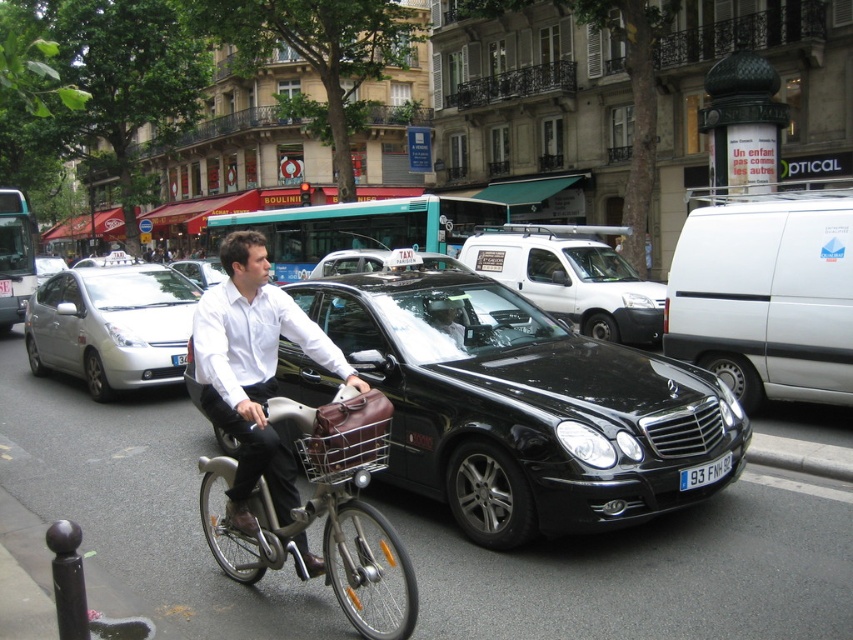
You are a delivery person who needs to park your 1.8 meters tall delivery box between the black glossy sedan at center and the silver metallic sedan at center. Can you fit it there?

The black glossy sedan at center is much taller than the silver metallic sedan at center. However, the height difference between them isn not specified, so it is uncertain if the 1.8 meters tall delivery box can fit between them.

You are a pedestrian standing on the sidewalk and see both the black glossy sedan at center and the silver metallic sedan at center. Which one is closer to the road?

The black glossy sedan at center is to the right of the silver metallic sedan at center, so it is closer to the road.

Based on the photo, you are standing on the sidewalk and want to cross the street to reach the black glossy sedan at center. The crosswalk is 5 meters away from your current position. Can you safely reach the sedan before the crosswalk ends?

The black glossy sedan at center is 4.43 meters from viewer, which is less than the 5 meters distance to the crosswalk. Therefore, you can safely reach the sedan before the crosswalk ends.